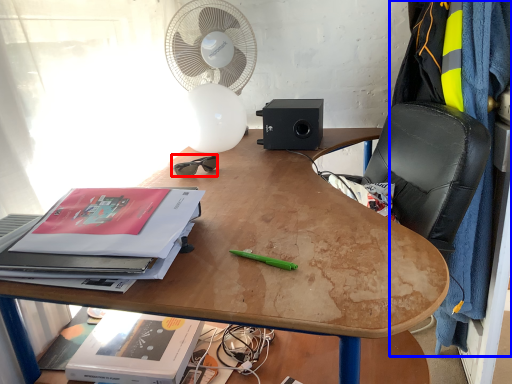
Question: Which of the following is the farthest to the observer, glasses (highlighted by a red box) or blanket (highlighted by a blue box)?

Choices:
 (A) glasses
 (B) blanket

Answer: (A)